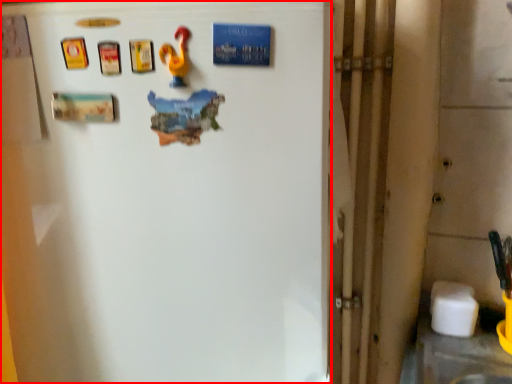
Question: From the image's perspective, where is refrigerator (annotated by the red box) located in relation to toy in the image?

Choices:
 (A) below
 (B) above

Answer: (A)